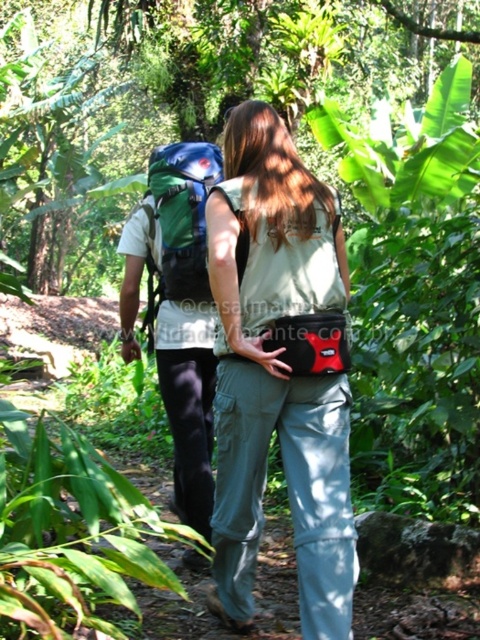
Question: Based on their relative distances, which object is nearer to the matte green backpack at center?

Choices:
 (A) green fabric backpack at center
 (B) green fabric backpack at left

Answer: (B)

Question: Which of the following is the closest to the observer?

Choices:
 (A) (311, 440)
 (B) (165, 221)
 (C) (204, 156)

Answer: (A)

Question: In this image, where is matte green backpack at center located relative to green fabric backpack at left?

Choices:
 (A) right
 (B) left

Answer: (A)

Question: From the image, what is the correct spatial relationship of green fabric backpack at left in relation to green fabric backpack at center?

Choices:
 (A) right
 (B) left

Answer: (B)

Question: Among these points, which one is farthest from the camera?

Choices:
 (A) (247, 524)
 (B) (213, 339)

Answer: (B)

Question: Is green fabric backpack at left closer to camera compared to green fabric backpack at center?

Choices:
 (A) no
 (B) yes

Answer: (A)